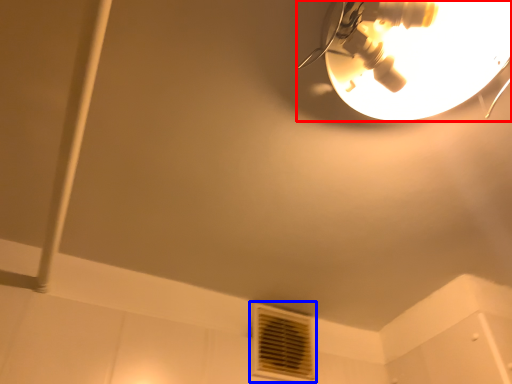
Question: Among these objects, which one is farthest to the camera, lamp (highlighted by a red box) or air conditioning (highlighted by a blue box)?

Choices:
 (A) lamp
 (B) air conditioning

Answer: (B)